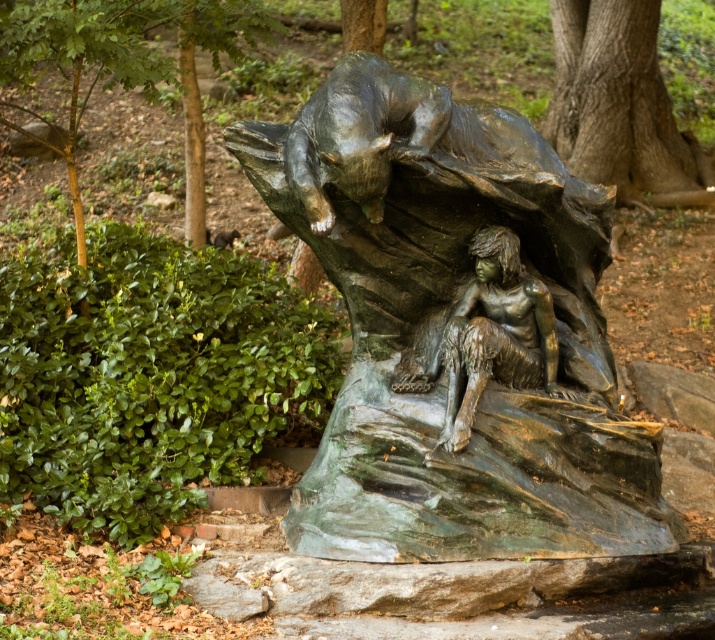
Question: Is smooth brown bark at upper center to the left of bronze figure at center from the viewer's perspective?

Choices:
 (A) no
 (B) yes

Answer: (A)

Question: From the image, what is the correct spatial relationship of green patina bronze sculpture at center in relation to bronze figure at center?

Choices:
 (A) right
 (B) left

Answer: (B)

Question: Where is green patina bronze sculpture at center located in relation to bronze figure at center in the image?

Choices:
 (A) right
 (B) left

Answer: (B)

Question: Considering the real-world distances, which object is closest to the bronze figure at center?

Choices:
 (A) smooth brown bark at upper center
 (B) green patina bronze sculpture at center

Answer: (B)

Question: Which point is closer to the camera?

Choices:
 (A) (561, 128)
 (B) (468, 250)

Answer: (B)

Question: Which point appears closest to the camera in this image?

Choices:
 (A) (468, 355)
 (B) (468, 188)
 (C) (593, 48)

Answer: (B)